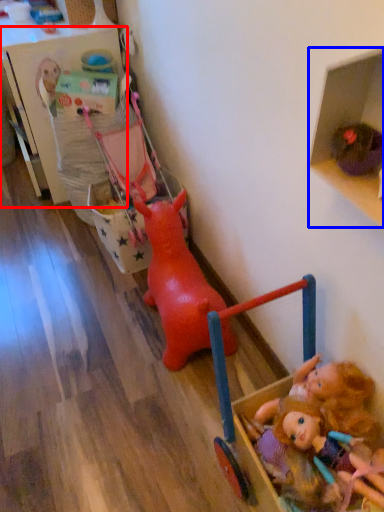
Question: Which point is further to the camera, shelf (highlighted by a red box) or shelf (highlighted by a blue box)?

Choices:
 (A) shelf
 (B) shelf

Answer: (A)